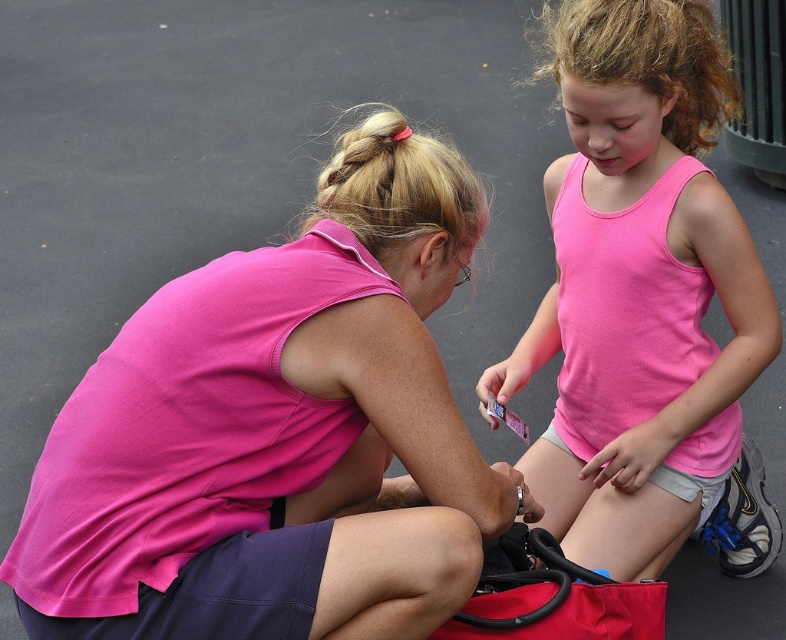
Is pink fabric shirt at center closer to camera compared to pink matte tank top at center?

Yes, pink fabric shirt at center is closer to the viewer.

Locate an element on the screen. The image size is (786, 640). pink fabric shirt at center is located at coordinates (278, 433).

Between point (318, 627) and point (597, 406), which one is positioned behind?

The point (597, 406) is more distant.

Where is `pink fabric shirt at center`? pink fabric shirt at center is located at coordinates pos(278,433).